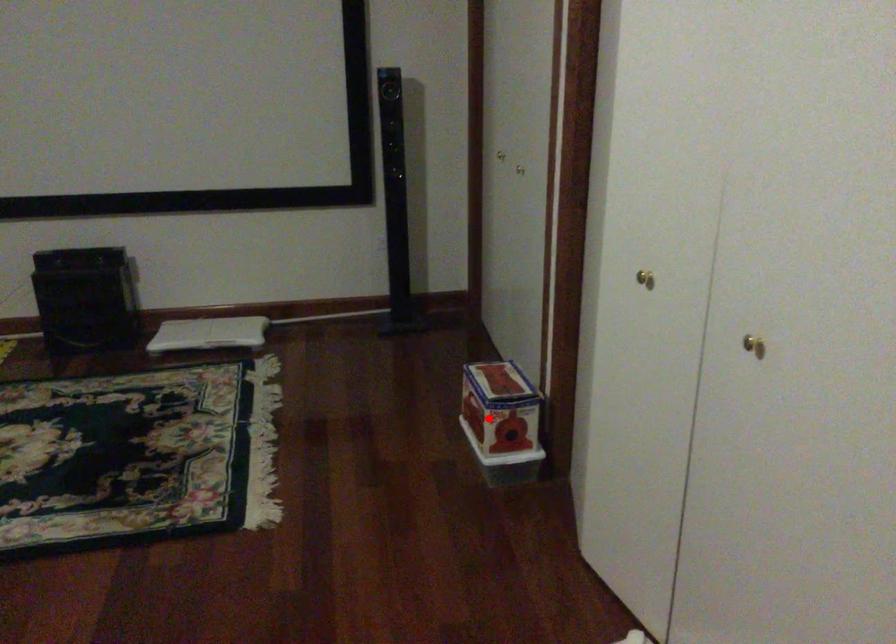
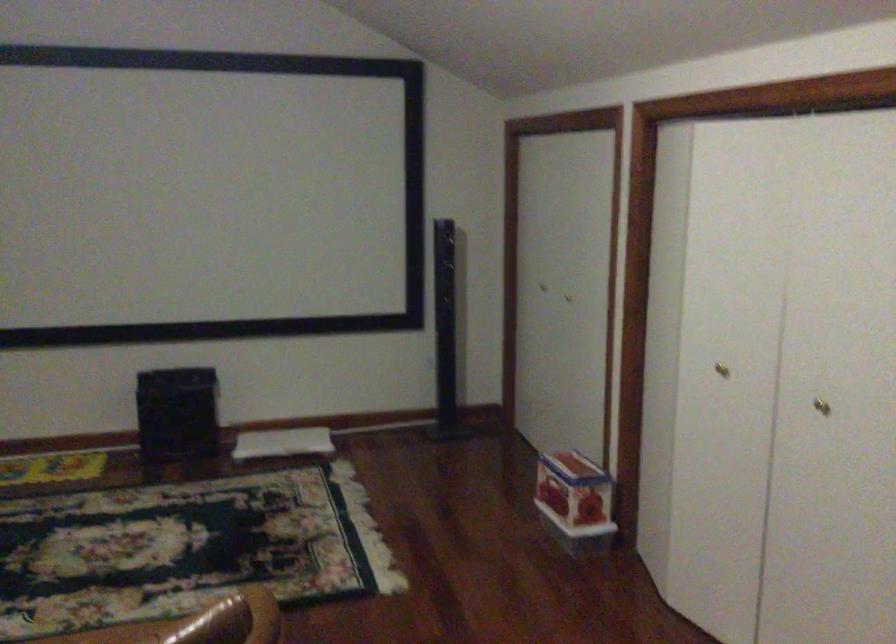
Question: A red point is marked in image1. In image2, is the corresponding 3D point closer to the camera or farther? Reply with the corresponding letter.

Choices:
 (A) The corresponding 3D point is closer.
 (B) The corresponding 3D point is farther.

Answer: (B)